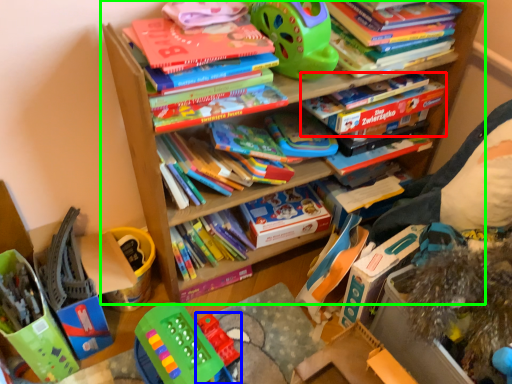
Question: Which object is the farthest from book (highlighted by a red box)? Choose among these: toy (highlighted by a blue box) or bookcase (highlighted by a green box).

Choices:
 (A) toy
 (B) bookcase

Answer: (A)